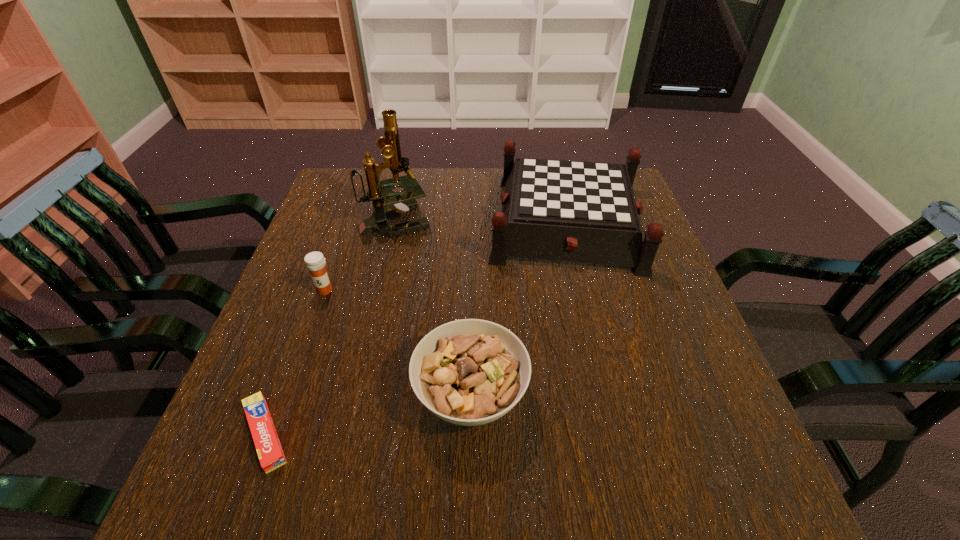
Where is `microscope`? This screenshot has width=960, height=540. microscope is located at coordinates (400, 202).

The image size is (960, 540). What are the coordinates of `checkerboard` in the screenshot? It's located at (573, 211).

Find the location of a particular element. the third farthest object is located at coordinates (315, 262).

You are a GUI agent. You are given a task and a screenshot of the screen. Output one action in this format:
    pyautogui.click(x=<x>, y=<y>)
    Task: Click on the stew
    Image resolution: width=960 pixels, height=540 pixels.
    Given the screenshot: What is the action you would take?
    pyautogui.click(x=469, y=372)

Locate an element on the screen. the shortest object is located at coordinates (271, 456).

You are a GUI agent. You are given a task and a screenshot of the screen. Output one action in this format:
    pyautogui.click(x=<x>, y=<y>)
    Task: Click on the free location located at the eyepiece of the microscope
    
    Given the screenshot: What is the action you would take?
    pyautogui.click(x=515, y=220)

Find the location of a particular element. free space located on the front of the checkerboard is located at coordinates tap(608, 393).

Locate an element on the screen. The image size is (960, 540). free space located on the label side of the medicine is located at coordinates (310, 331).

You are a GUI agent. You are given a task and a screenshot of the screen. Output one action in this format:
    pyautogui.click(x=<x>, y=<y>)
    Task: Click on the free location located on the left of the stew
    
    Given the screenshot: What is the action you would take?
    pyautogui.click(x=248, y=394)

Where is `vacant space positioned on the back of the shortest object`? The height and width of the screenshot is (540, 960). vacant space positioned on the back of the shortest object is located at coordinates (322, 281).